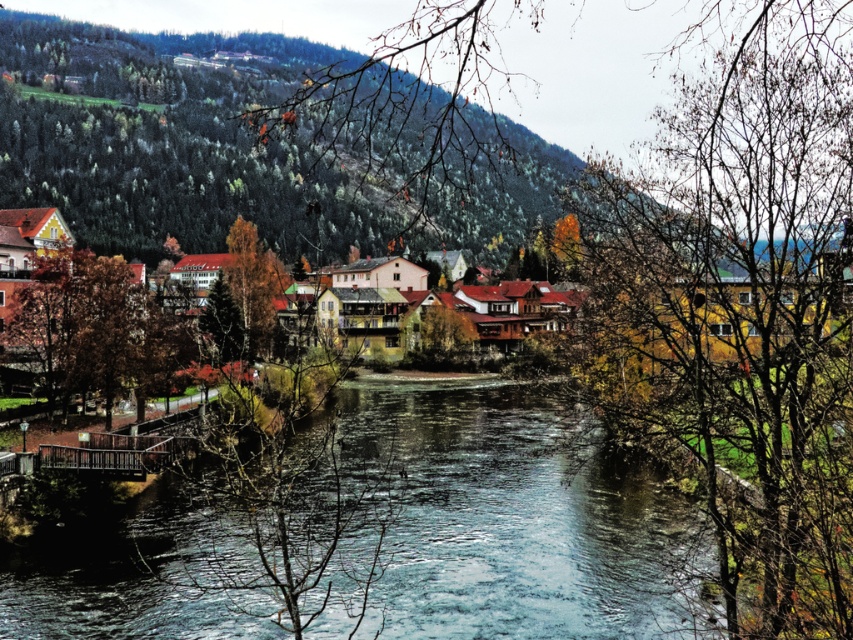
You are standing at the edge of the village and want to cross the river to reach the other side. There is a small bridge on the left and a clear water stream at center. Which path would allow you to stay closer to the golden yellow leaves at center while crossing?

The clear water stream at center is closer to the viewer than the golden yellow leaves at center, so crossing via the clear water stream at center would keep you closer to the golden yellow leaves at center.

You are planning to cross the river using a small boat that is 2 meters wide. The boat can only be placed on the clear water stream at center. Given that the golden yellow leaves at center are narrower than the stream, will the boat fit within the stream?

The clear water stream at center is wider than the golden yellow leaves at center, so the boat that is 2 meters wide can fit within the stream as long as the stream itself is wide enough to accommodate the boat.

You are standing at the edge of the river in the village scene. You see the bare branches at center and the clear water stream at center. Which object is closer to you?

The bare branches at center are closer to the viewer than the clear water stream at center.